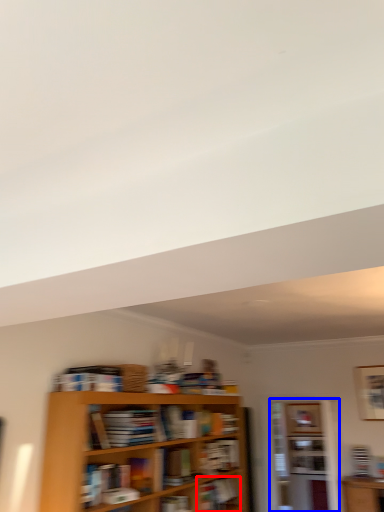
Question: Among these objects, which one is farthest to the camera, book (highlighted by a red box) or shelf (highlighted by a blue box)?

Choices:
 (A) book
 (B) shelf

Answer: (B)